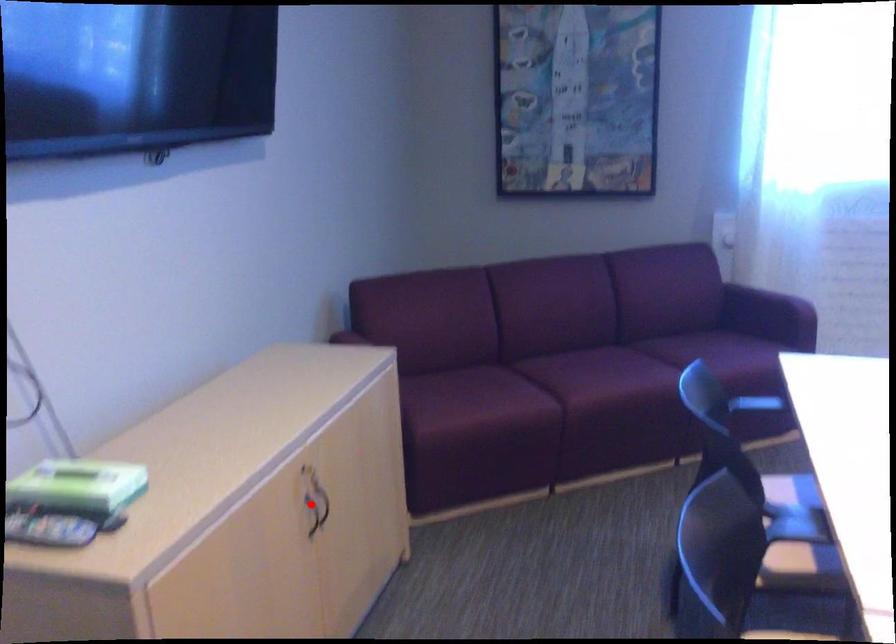
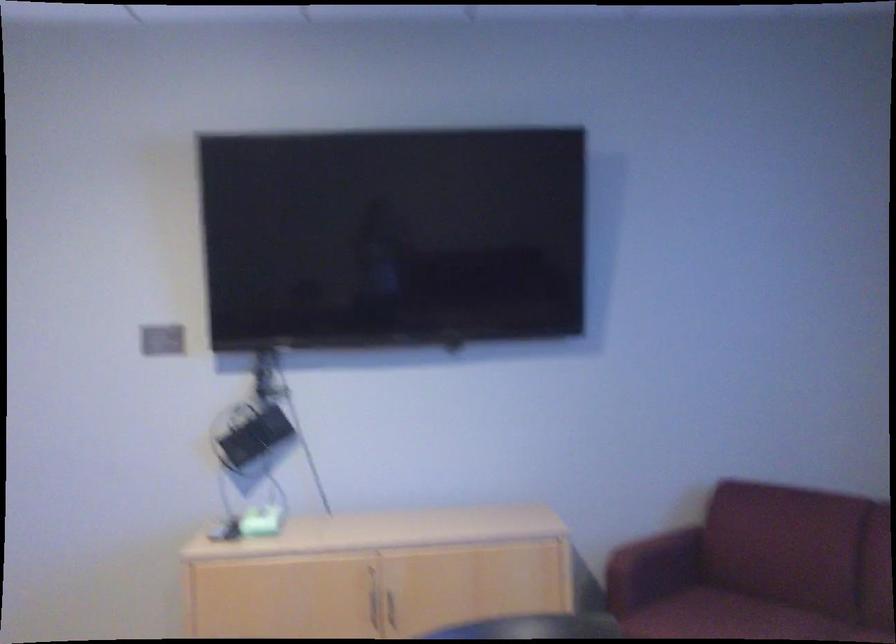
Where in the second image is the point corresponding to the highlighted location from the first image?

(392, 607)